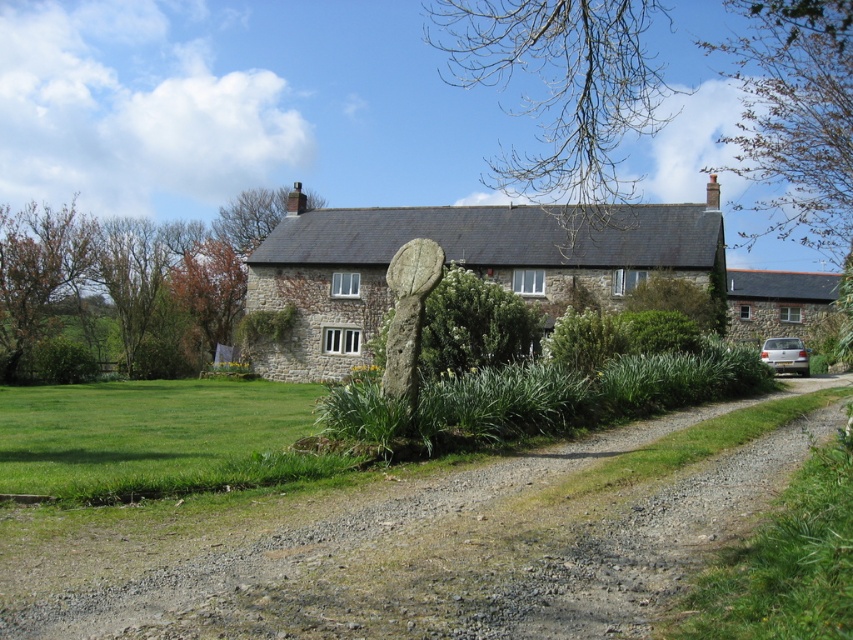
You are a visitor approaching the stone cottage at center from the gravel at center. Which object will you step onto first?

You will step onto the gravel at center first because it is smaller than the stone cottage at center, meaning the cottage is larger and likely positioned behind or elevated above the gravel path.

You are standing in front of the traditional stone house and want to walk towards the gravel at center and the silver metallic car at right. Which object will you encounter first?

You will encounter the gravel at center first because it is closer to you than the silver metallic car at right.